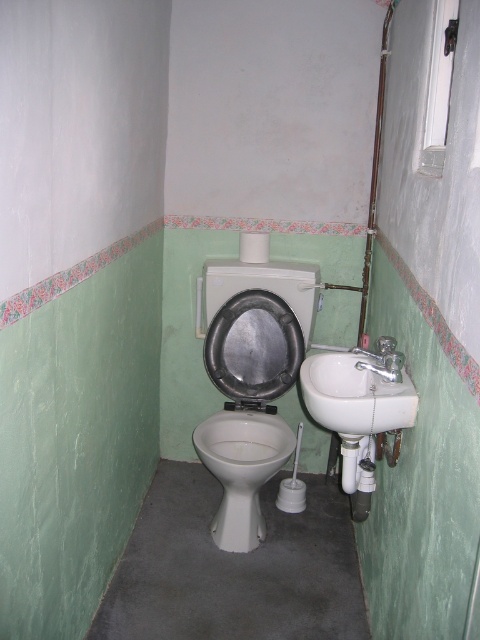
You are a plumber inspecting the bathroom and need to determine which object is taller between the white glossy toilet bowl at center and the white ceramic sink at right. Based on the scene, which one is taller?

The white glossy toilet bowl at center is taller than the white ceramic sink at right according to the description.

You are standing in the bathroom and want to reach the toilet paper roll mounted above the toilet tank. The toilet is located at point (228, 412). If you are currently at the sink, which is 2.52 meters away from your current position, can you reach the toilet paper roll without moving closer?

→ The distance between your current position at the sink and the toilet paper roll above the toilet tank is 2.52 meters. Since you need to be closer to reach it, you would need to move nearer to the toilet to access the toilet paper roll.

In the bathroom scene described, there are two objects labeled as the white glossy toilet at center and the white glossy toilet bowl at center. Which of these two objects is taller?

The white glossy toilet at center is much taller than the white glossy toilet bowl at center.